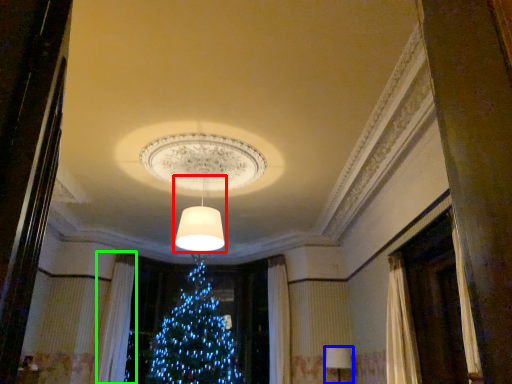
Question: Which object is the closest to the lamp (highlighted by a red box)? Choose among these: lamp (highlighted by a blue box) or curtain (highlighted by a green box).

Choices:
 (A) lamp
 (B) curtain

Answer: (A)